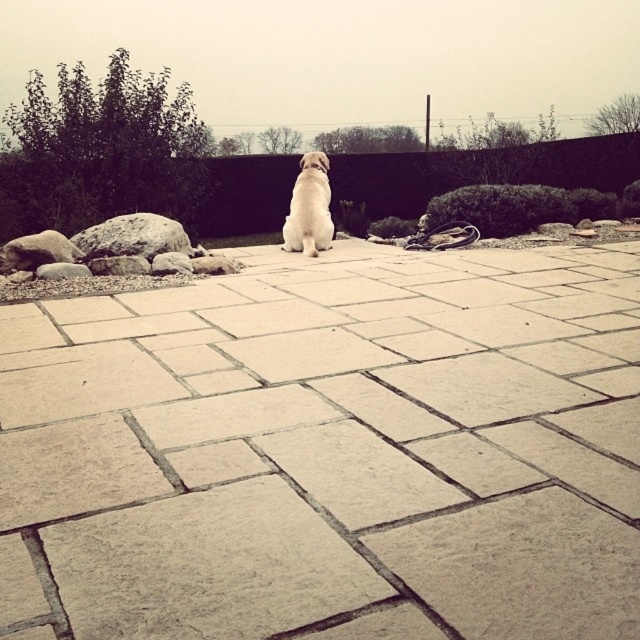
Does beige stone pavement at center have a lesser height compared to gray rock at center?

In fact, beige stone pavement at center may be taller than gray rock at center.

Who is higher up, beige stone pavement at center or gray rock at center?

gray rock at center

Identify the location of beige stone pavement at center. The image size is (640, 640). (328, 451).

Identify the location of beige stone pavement at center. (328, 451).